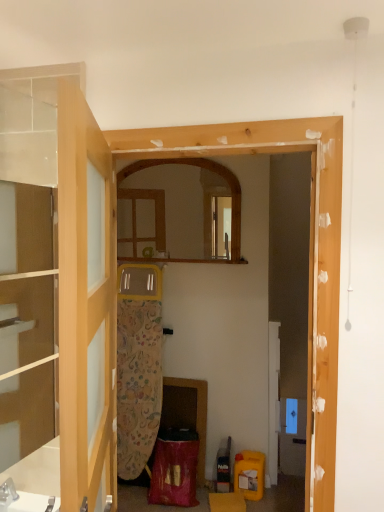
The image size is (384, 512). What do you see at coordinates (163, 181) in the screenshot? I see `wooden mirror at center` at bounding box center [163, 181].

What is the approximate width of wooden mirror at center?

It is 2.56 inches.

The height and width of the screenshot is (512, 384). Describe the element at coordinates (27, 320) in the screenshot. I see `transparent glass cabinet at left` at that location.

Describe the element at coordinates (86, 306) in the screenshot. I see `clear glass door at left` at that location.

This screenshot has height=512, width=384. Identify the location of wooden mirror at center. (163, 181).

Can you tell me how much wooden mirror at center and clear glass door at left differ in facing direction?

There is a 109-degree angle between the facing directions of wooden mirror at center and clear glass door at left.

You are a GUI agent. You are given a task and a screenshot of the screen. Output one action in this format:
    pyautogui.click(x=<x>, y=<y>)
    Task: Click on the mirror lying on the right of clear glass door at left
    
    Given the screenshot: What is the action you would take?
    pyautogui.click(x=163, y=181)

Does point (144, 175) appear closer or farther from the camera than point (89, 361)?

Clearly, point (144, 175) is more distant from the camera than point (89, 361).

Is wooden mirror at center located outside clear glass door at left?

Yes, wooden mirror at center is located beyond the bounds of clear glass door at left.

Is point (27, 416) closer to camera compared to point (202, 216)?

Yes, point (27, 416) is closer to viewer.

From the image's perspective, does transparent glass cabinet at left appear higher than wooden mirror at center?

No, from the image's perspective, transparent glass cabinet at left is not over wooden mirror at center.

Is transparent glass cabinet at left oriented towards wooden mirror at center?

No, transparent glass cabinet at left is not aimed at wooden mirror at center.

Which is correct: transparent glass cabinet at left is inside wooden mirror at center, or outside of it?

transparent glass cabinet at left is outside wooden mirror at center.

Is clear glass door at left far from wooden mirror at center?

Yes, clear glass door at left and wooden mirror at center are located far from each other.

Is clear glass door at left oriented away from wooden mirror at center?

clear glass door at left is not turned away from wooden mirror at center.

Is clear glass door at left wider or thinner than wooden mirror at center?

In the image, clear glass door at left appears to be wider than wooden mirror at center.

How far apart are clear glass door at left and wooden mirror at center?

2.25 meters.

From a real-world perspective, is clear glass door at left located beneath transparent glass cabinet at left?

Indeed, from a real-world perspective, clear glass door at left is positioned beneath transparent glass cabinet at left.

Which object is thinner, clear glass door at left or transparent glass cabinet at left?

With smaller width is transparent glass cabinet at left.

Is clear glass door at left closer to camera compared to transparent glass cabinet at left?

Yes, clear glass door at left is in front of transparent glass cabinet at left.

Which is more to the left, wooden mirror at center or transparent glass cabinet at left?

Positioned to the left is transparent glass cabinet at left.

The image size is (384, 512). Identify the location of mirror on the right of transparent glass cabinet at left. (163, 181).

Consider the image. Could you tell me if wooden mirror at center is facing transparent glass cabinet at left?

Yes, wooden mirror at center is oriented towards transparent glass cabinet at left.

Is wooden mirror at center taller than transparent glass cabinet at left?

No, wooden mirror at center is not taller than transparent glass cabinet at left.

Considering the relative sizes of transparent glass cabinet at left and clear glass door at left in the image provided, is transparent glass cabinet at left taller than clear glass door at left?

Indeed, transparent glass cabinet at left has a greater height compared to clear glass door at left.

How many degrees apart are the facing directions of transparent glass cabinet at left and clear glass door at left?

The facing directions of transparent glass cabinet at left and clear glass door at left are 27.4 degrees apart.

From the image's perspective, which object appears higher, transparent glass cabinet at left or clear glass door at left?

transparent glass cabinet at left.

From the picture: Between transparent glass cabinet at left and clear glass door at left, which one has smaller width?

transparent glass cabinet at left is thinner.

Where is `mirror positioned vertically above the clear glass door at left (from a real-world perspective)`? mirror positioned vertically above the clear glass door at left (from a real-world perspective) is located at coordinates (163, 181).

Identify the location of cabinetry lying below the wooden mirror at center (from the image's perspective). (27, 320).

Looking at the image, which one is located closer to wooden mirror at center, transparent glass cabinet at left or clear glass door at left?

transparent glass cabinet at left is closer to wooden mirror at center.

Based on their spatial positions, is clear glass door at left or wooden mirror at center further from transparent glass cabinet at left?

The object further to transparent glass cabinet at left is wooden mirror at center.

From the image, which object appears to be nearer to wooden mirror at center, clear glass door at left or transparent glass cabinet at left?

transparent glass cabinet at left lies closer to wooden mirror at center than the other object.

Which object lies further to the anchor point transparent glass cabinet at left, wooden mirror at center or clear glass door at left?

The object further to transparent glass cabinet at left is wooden mirror at center.

From the image, which object appears to be nearer to clear glass door at left, transparent glass cabinet at left or wooden mirror at center?

Based on the image, transparent glass cabinet at left appears to be nearer to clear glass door at left.

From the picture: Considering their positions, is wooden mirror at center positioned closer to clear glass door at left than transparent glass cabinet at left?

transparent glass cabinet at left.

Where is `cabinetry between clear glass door at left and wooden mirror at center along the z-axis`? The height and width of the screenshot is (512, 384). cabinetry between clear glass door at left and wooden mirror at center along the z-axis is located at coordinates (27, 320).